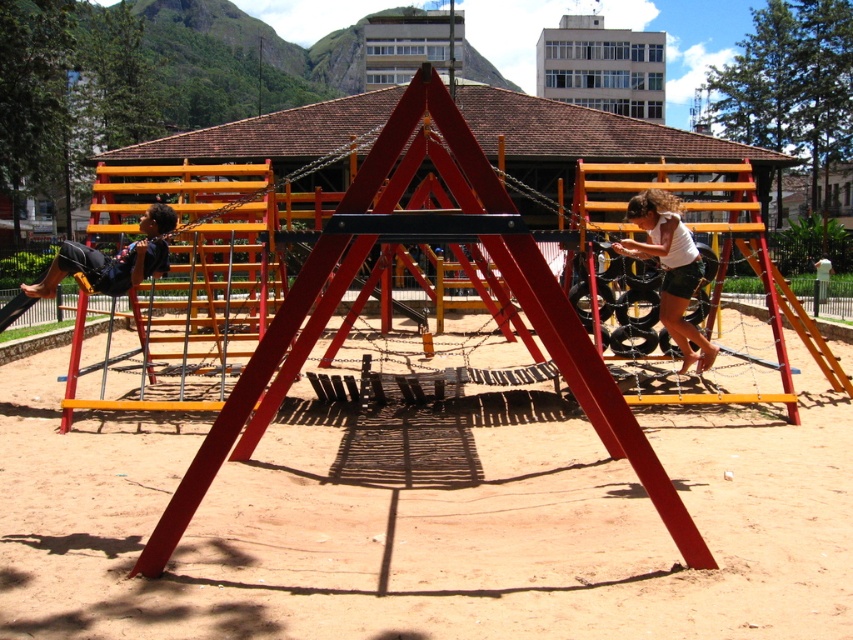
Based on the photo, can you confirm if white cotton shirt at upper right is bigger than matte black shorts at left?

Correct, white cotton shirt at upper right is larger in size than matte black shorts at left.

Is white cotton shirt at upper right smaller than matte black shorts at left?

No, white cotton shirt at upper right is not smaller than matte black shorts at left.

The image size is (853, 640). In order to click on white cotton shirt at upper right in this screenshot , I will do `click(670, 268)`.